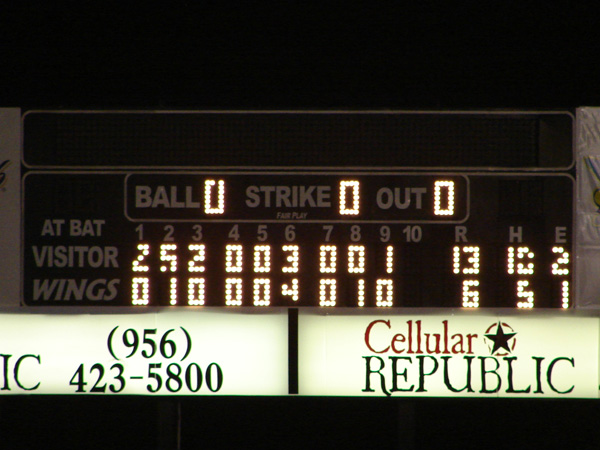
This screenshot has height=450, width=600. Identify the location of board. [591, 198].